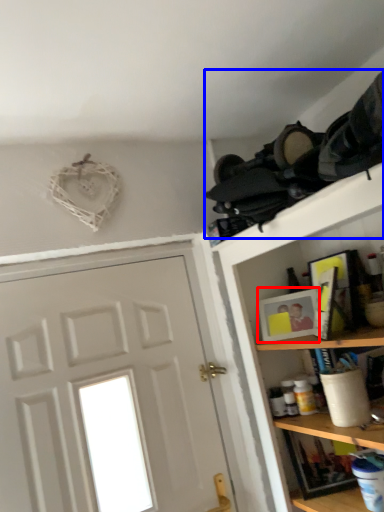
Question: Which point is further to the camera, picture frame (highlighted by a red box) or laundry (highlighted by a blue box)?

Choices:
 (A) picture frame
 (B) laundry

Answer: (A)